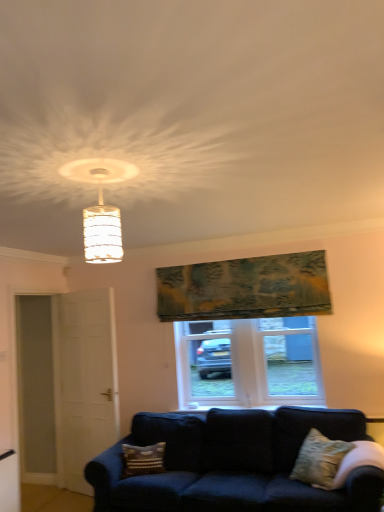
Question: From a real-world perspective, relative to white matte door at left, is white plastic window at center vertically above or below?

Choices:
 (A) above
 (B) below

Answer: (A)

Question: Based on their sizes in the image, would you say white plastic window at center is bigger or smaller than white matte door at left?

Choices:
 (A) big
 (B) small

Answer: (B)

Question: Which of these objects is positioned farthest from the white plastic window at center?

Choices:
 (A) textured green tapestry at upper center
 (B) patterned fabric pillow at lower center, acting as the 2th pillow starting from the right
 (C) white matte door at left
 (D) textured beige pillow at lower right, which ranks as the second pillow in left-to-right order
 (E) translucent glass lampshade at upper center

Answer: (E)

Question: Based on their relative distances, which object is farther from the white matte door at left?

Choices:
 (A) textured green tapestry at upper center
 (B) patterned fabric pillow at lower center, positioned as the second pillow in front-to-back order
 (C) translucent glass lampshade at upper center
 (D) white plastic window at center
 (E) textured beige pillow at lower right, the 1th pillow viewed from the right

Answer: (C)